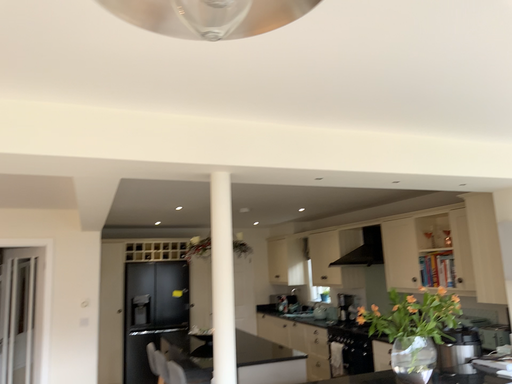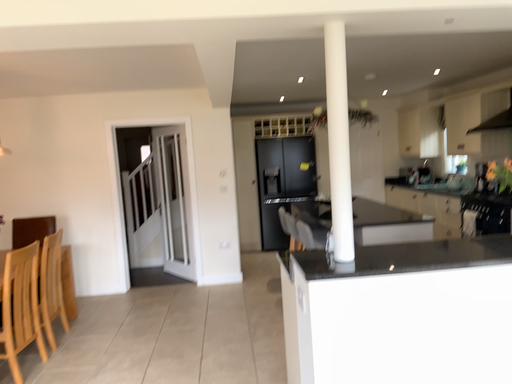
Question: Which way did the camera rotate in the video?

Choices:
 (A) rotated left
 (B) rotated right

Answer: (A)